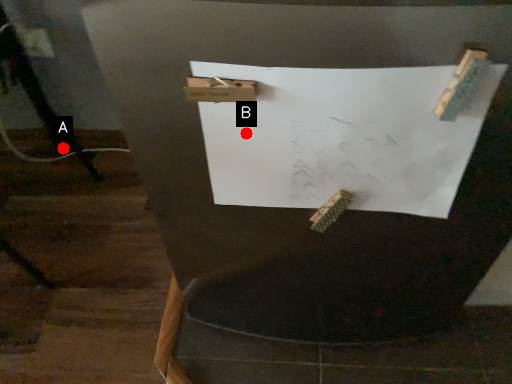
Question: Two points are circled on the image, labeled by A and B beside each circle. Which point is closer to the camera?

Choices:
 (A) A is closer
 (B) B is closer

Answer: (B)